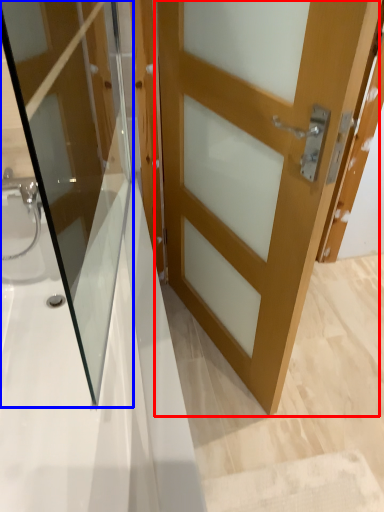
Question: Among these objects, which one is nearest to the camera, door (highlighted by a red box) or door (highlighted by a blue box)?

Choices:
 (A) door
 (B) door

Answer: (B)